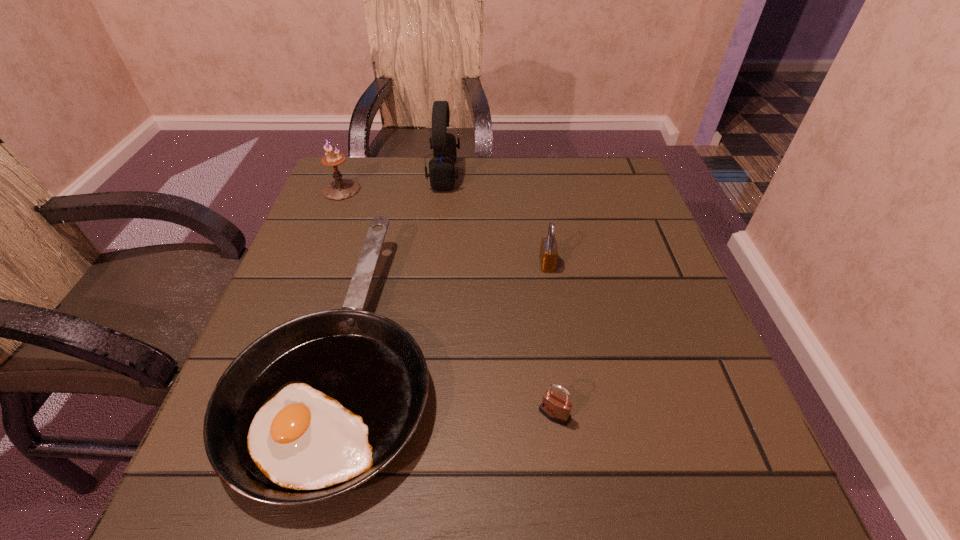
At what (x,y) coordinates should I click in order to perform the action: click on free space between the shorter padlock and the taller padlock. Please return your answer as a coordinate pair (x, y). Looking at the image, I should click on (551, 339).

Find the location of a particular element. The width and height of the screenshot is (960, 540). vacant region between the fourth shortest object and the shorter padlock is located at coordinates (447, 302).

Locate an element on the screen. The width and height of the screenshot is (960, 540). free point between the shorter padlock and the headset is located at coordinates (499, 294).

Identify which object is the fourth closest to the second tallest object. Please provide its 2D coordinates. Your answer should be formatted as a tuple, i.e. [(x, y)], where the tuple contains the x and y coordinates of a point satisfying the conditions above.

[(556, 407)]

At what (x,y) coordinates should I click in order to perform the action: click on the closest object to the taller padlock. Please return your answer as a coordinate pair (x, y). This screenshot has height=540, width=960. Looking at the image, I should click on (315, 407).

The height and width of the screenshot is (540, 960). I want to click on vacant space that satisfies the following two spatial constraints: 1. on the headband of the headset; 2. on the back side of the nearer padlock, so click(x=420, y=414).

Find the location of `free space that satisfies the following two spatial constraints: 1. on the headband of the headset; 2. on the back side of the third shortest object`. free space that satisfies the following two spatial constraints: 1. on the headband of the headset; 2. on the back side of the third shortest object is located at coordinates (435, 264).

Locate an element on the screen. vacant point that satisfies the following two spatial constraints: 1. on the front side of the candle holder; 2. on the right side of the third tallest object is located at coordinates (312, 264).

Identify the location of free space that satisfies the following two spatial constraints: 1. on the headband of the tallest object; 2. on the front side of the fourth shortest object. click(x=443, y=190).

Find the location of `vacant region that satisfies the following two spatial constraints: 1. on the headband of the farther padlock; 2. on the right side of the headset`. vacant region that satisfies the following two spatial constraints: 1. on the headband of the farther padlock; 2. on the right side of the headset is located at coordinates (435, 264).